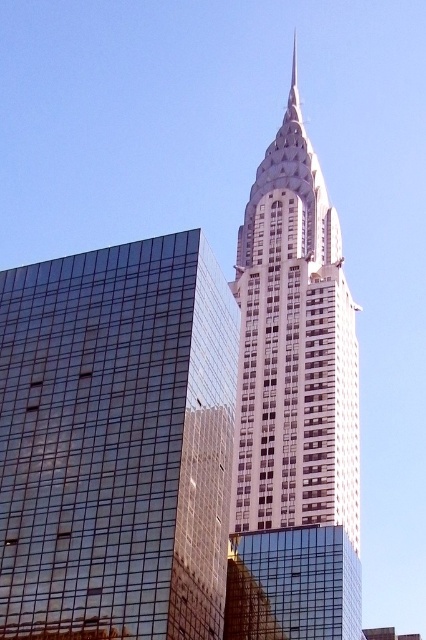
Question: Which point appears farthest from the camera in this image?

Choices:
 (A) (163, 600)
 (B) (252, 202)

Answer: (B)

Question: In this image, where is glassy reflective skyscraper at center located relative to white glass tower at center?

Choices:
 (A) above
 (B) below

Answer: (B)

Question: In this image, where is glassy reflective skyscraper at center located relative to white glass tower at center?

Choices:
 (A) below
 (B) above

Answer: (A)

Question: Is glassy reflective skyscraper at center wider than white glass tower at center?

Choices:
 (A) no
 (B) yes

Answer: (A)

Question: Which of the following is the closest to the observer?

Choices:
 (A) (163, 620)
 (B) (317, 579)

Answer: (A)